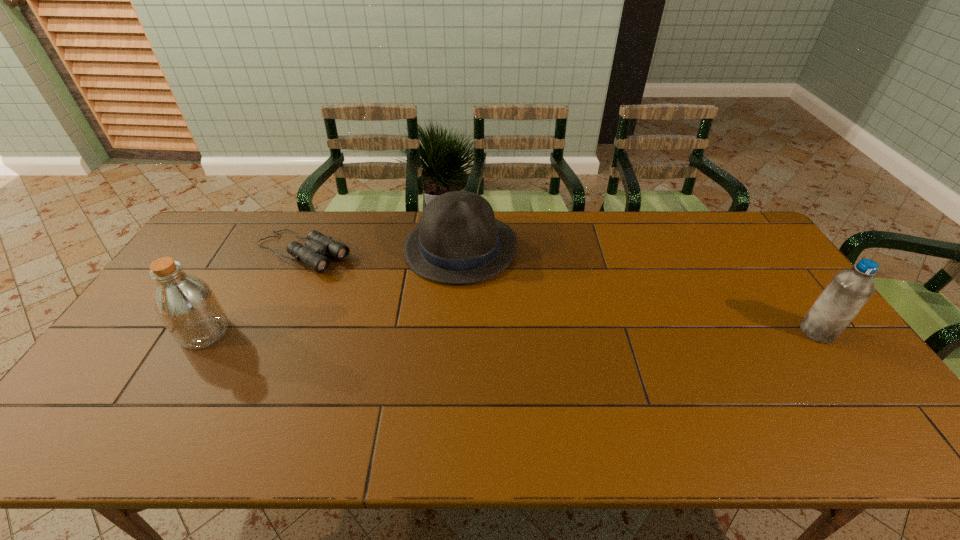
This screenshot has width=960, height=540. What are the coordinates of `bottle` in the screenshot? It's located at [188, 307].

Find the location of `the rightmost object`. the rightmost object is located at coordinates pos(848,291).

I want to click on bowler hat, so click(458, 240).

Where is `the second object from right to left`? The height and width of the screenshot is (540, 960). the second object from right to left is located at coordinates (x=458, y=240).

You are a GUI agent. You are given a task and a screenshot of the screen. Output one action in this format:
    pyautogui.click(x=<x>, y=<y>)
    Task: Click on the binoculars
    
    Given the screenshot: What is the action you would take?
    pyautogui.click(x=317, y=244)

You are a GUI agent. You are given a task and a screenshot of the screen. Output one action in this format:
    pyautogui.click(x=<x>, y=<y>)
    Task: Click on the free region located on the right of the bottle
    
    Given the screenshot: What is the action you would take?
    pyautogui.click(x=364, y=332)

Find the location of a particular element. This screenshot has height=540, width=960. vacant space located on the left of the water bottle is located at coordinates (772, 332).

Identify the location of free spot located on the front-facing side of the bowler hat. (495, 347).

This screenshot has width=960, height=540. I want to click on free region located on the front-facing side of the bowler hat, so click(x=481, y=307).

Locate an element on the screen. Image resolution: width=960 pixels, height=540 pixels. vacant space located on the front-facing side of the bowler hat is located at coordinates (497, 352).